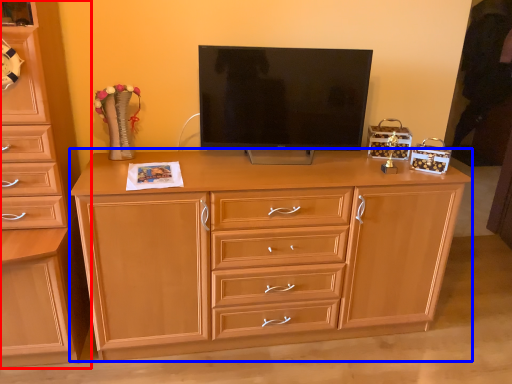
Question: Which object appears farthest to the camera in this image, chest of drawers (highlighted by a red box) or chest of drawers (highlighted by a blue box)?

Choices:
 (A) chest of drawers
 (B) chest of drawers

Answer: (B)